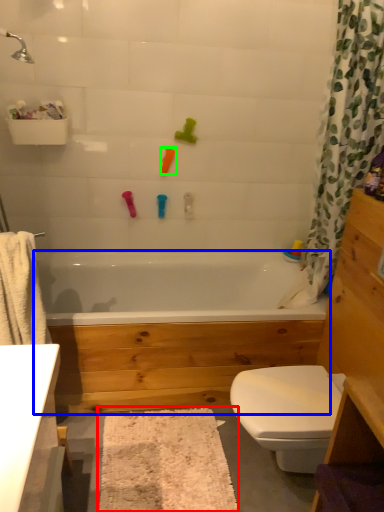
Question: Estimate the real-world distances between objects in this image. Which object is closer to bath mat (highlighted by a red box), bathtub (highlighted by a blue box) or toy (highlighted by a green box)?

Choices:
 (A) bathtub
 (B) toy

Answer: (A)